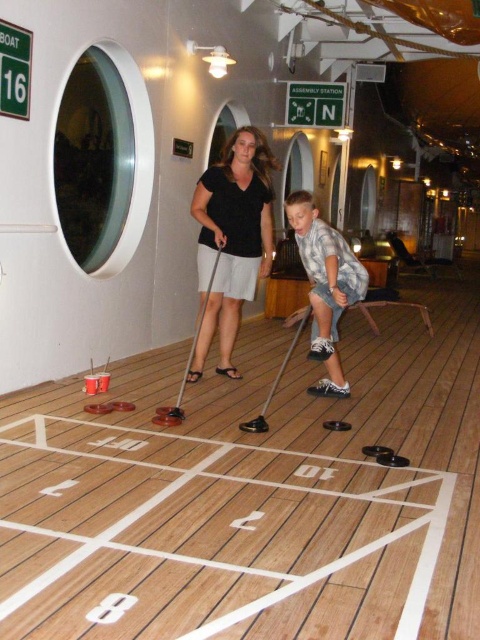
Question: Does black matte shirt at center have a smaller size compared to checkered fabric shirt at center?

Choices:
 (A) yes
 (B) no

Answer: (A)

Question: Among these objects, which one is nearest to the camera?

Choices:
 (A) checkered fabric shirt at center
 (B) black matte shirt at center

Answer: (A)

Question: Is black matte shirt at center above checkered fabric shirt at center?

Choices:
 (A) no
 (B) yes

Answer: (B)

Question: Is black matte shirt at center positioned before checkered fabric shirt at center?

Choices:
 (A) yes
 (B) no

Answer: (B)

Question: Which of the following is the closest to the observer?

Choices:
 (A) black matte shirt at center
 (B) checkered fabric shirt at center

Answer: (B)